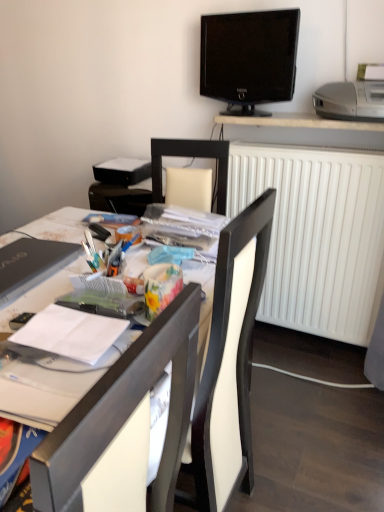
Question: From a real-world perspective, is matte black laptop at left physically above white plastic chair at center?

Choices:
 (A) no
 (B) yes

Answer: (B)

Question: Can you confirm if matte black laptop at left is bigger than white plastic chair at center?

Choices:
 (A) yes
 (B) no

Answer: (B)

Question: Is matte black laptop at left positioned far away from white plastic chair at center?

Choices:
 (A) yes
 (B) no

Answer: (B)

Question: From a real-world perspective, is matte black laptop at left below white plastic chair at center?

Choices:
 (A) no
 (B) yes

Answer: (A)

Question: Considering the relative positions of matte black laptop at left and white plastic chair at center in the image provided, is matte black laptop at left to the left of white plastic chair at center from the viewer's perspective?

Choices:
 (A) no
 (B) yes

Answer: (B)

Question: Is matte black laptop at left situated inside white matte radiator at right or outside?

Choices:
 (A) outside
 (B) inside

Answer: (A)

Question: From a real-world perspective, relative to white matte radiator at right, is matte black laptop at left vertically above or below?

Choices:
 (A) above
 (B) below

Answer: (A)

Question: Relative to white matte radiator at right, is matte black laptop at left in front or behind?

Choices:
 (A) front
 (B) behind

Answer: (A)

Question: Looking at their shapes, would you say matte black laptop at left is wider or thinner than white matte radiator at right?

Choices:
 (A) wide
 (B) thin

Answer: (A)

Question: Is point (278, 241) closer or farther from the camera than point (357, 117)?

Choices:
 (A) farther
 (B) closer

Answer: (A)

Question: Based on their sizes in the image, would you say white matte radiator at right is bigger or smaller than silver metallic printer at upper right?

Choices:
 (A) big
 (B) small

Answer: (A)

Question: From a real-world perspective, is white matte radiator at right positioned above or below silver metallic printer at upper right?

Choices:
 (A) above
 (B) below

Answer: (B)

Question: Considering the relative positions of white matte radiator at right and silver metallic printer at upper right in the image provided, is white matte radiator at right to the left or to the right of silver metallic printer at upper right?

Choices:
 (A) right
 (B) left

Answer: (B)

Question: Is white glossy desk at upper center to the left or to the right of black glossy tv at upper center in the image?

Choices:
 (A) right
 (B) left

Answer: (A)

Question: From a real-world perspective, is white glossy desk at upper center above or below black glossy tv at upper center?

Choices:
 (A) above
 (B) below

Answer: (B)